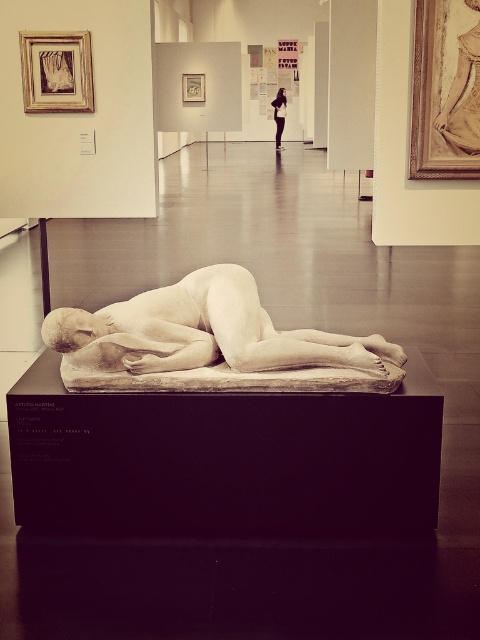
You are an art curator planning to install a new lighting system in the gallery. The lighting needs to highlight both the white marble sculpture at center and the black leather jacket at upper center. Given their heights, which object should be placed on a higher platform to ensure both are visible from the entrance?

The black leather jacket at upper center should be placed on a higher platform because it is taller than the white marble sculpture at center, ensuring both are visible from the entrance.

You are standing in an art gallery and want to take a closer look at the white marble sculpture at center. The gallery has a rule that visitors must stay at least 10 feet away from all artworks. Can you approach the sculpture without violating the rule?

The distance between you and the white marble sculpture at center is 10.14 feet, which is slightly more than the required 10 feet. Therefore, you can move closer by approximately 1.68 inches without breaking the gallery rule.